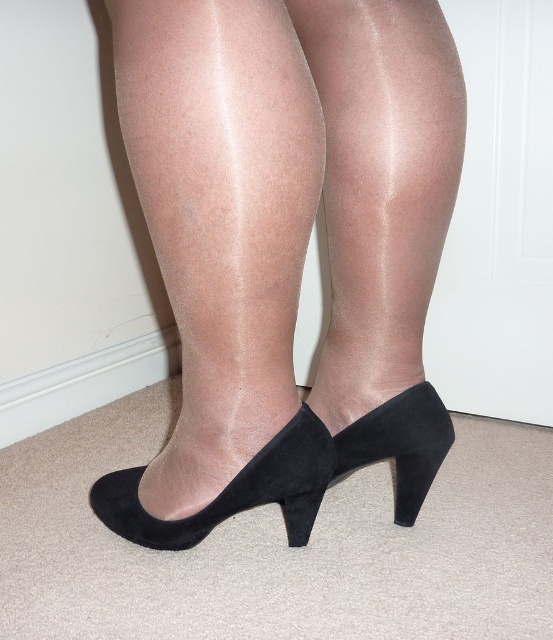
Is suede-like black high-heeled shoe at center wider than suede black high-heeled shoe at center?

Correct, the width of suede-like black high-heeled shoe at center exceeds that of suede black high-heeled shoe at center.

Can you confirm if suede-like black high-heeled shoe at center is bigger than suede black high-heeled shoe at center?

Correct, suede-like black high-heeled shoe at center is larger in size than suede black high-heeled shoe at center.

The height and width of the screenshot is (640, 553). I want to click on suede-like black high-heeled shoe at center, so click(221, 260).

The width and height of the screenshot is (553, 640). I want to click on suede-like black high-heeled shoe at center, so [x=221, y=260].

Who is more distant from viewer, (422, 435) or (124, 481)?

The point (124, 481) is more distant.

Can you confirm if satin smooth pantyhose at center is thinner than suede black high-heeled shoe at lower center?

Correct, satin smooth pantyhose at center's width is less than suede black high-heeled shoe at lower center's.

What do you see at coordinates (383, 225) in the screenshot?
I see `satin smooth pantyhose at center` at bounding box center [383, 225].

This screenshot has width=553, height=640. I want to click on satin smooth pantyhose at center, so click(x=383, y=225).

Between point (349, 456) and point (106, 506), which one is positioned in front?

Point (349, 456) is more forward.

Which of these two, suede black high-heeled shoe at center or suede black high-heeled shoe at lower center, stands shorter?

With less height is suede black high-heeled shoe at lower center.

The height and width of the screenshot is (640, 553). I want to click on suede black high-heeled shoe at center, so click(362, 456).